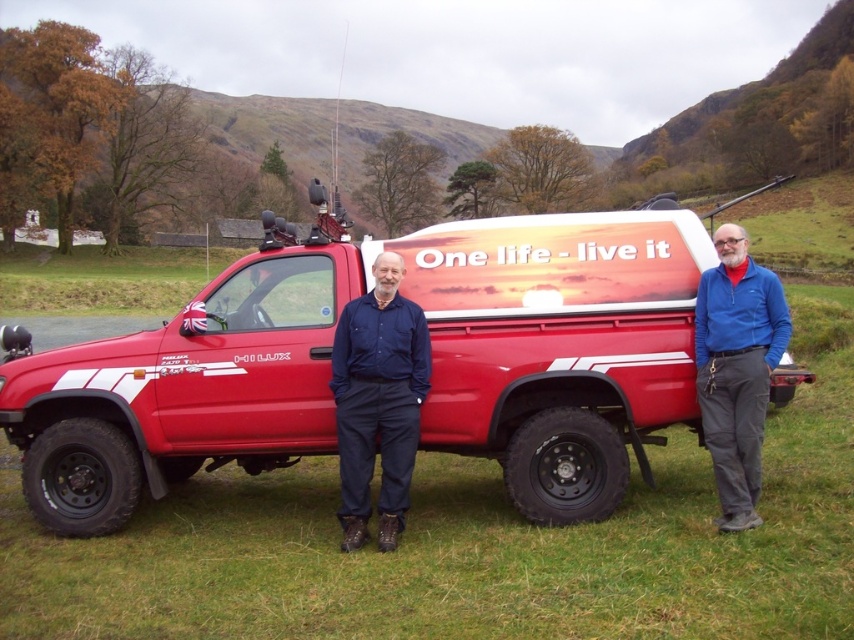
Question: Is shiny red truck at center smaller than matte blue shirt at center?

Choices:
 (A) no
 (B) yes

Answer: (A)

Question: Estimate the real-world distances between objects in this image. Which object is closer to the shiny red truck at center?

Choices:
 (A) matte blue shirt at center
 (B) blue fabric jacket at right

Answer: (A)

Question: Is shiny red truck at center positioned before blue fabric jacket at right?

Choices:
 (A) yes
 (B) no

Answer: (B)

Question: Which point is closer to the camera?

Choices:
 (A) blue fabric jacket at right
 (B) matte blue shirt at center

Answer: (A)

Question: Among these points, which one is farthest from the camera?

Choices:
 (A) (749, 516)
 (B) (200, 440)

Answer: (B)

Question: Is shiny red truck at center to the right of matte blue shirt at center from the viewer's perspective?

Choices:
 (A) yes
 (B) no

Answer: (B)